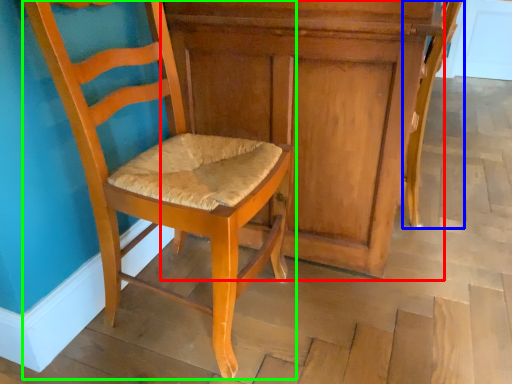
Question: Which object is positioned closest to dresser (highlighted by a red box)? Select from chair (highlighted by a blue box) and chair (highlighted by a green box).

Choices:
 (A) chair
 (B) chair

Answer: (B)